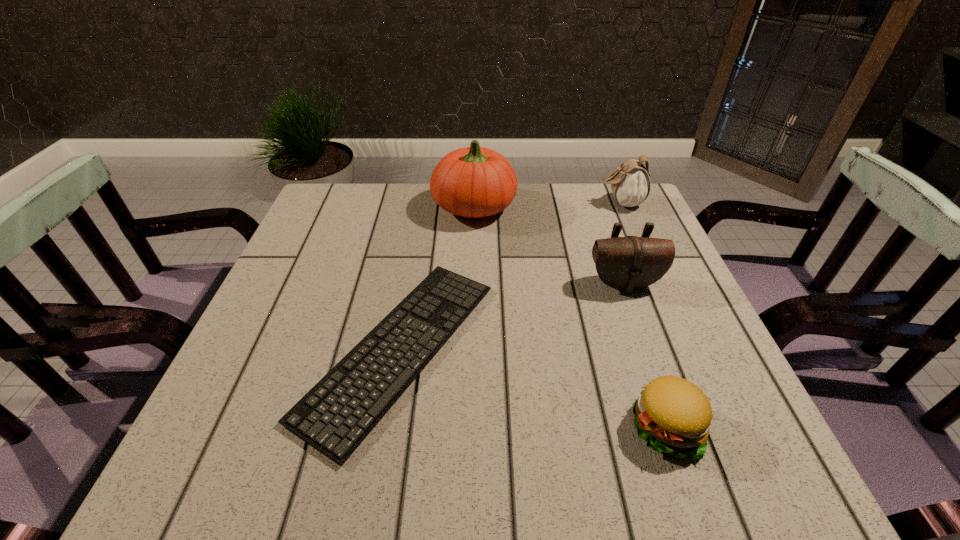
Where is `object that is at the near right corner`? This screenshot has height=540, width=960. object that is at the near right corner is located at coordinates (673, 415).

In the image, there is a desktop. At what (x,y) coordinates should I click in order to perform the action: click on free space at the far edge. Please return your answer as a coordinate pair (x, y). The width and height of the screenshot is (960, 540). Looking at the image, I should click on (403, 213).

Find the location of a particular element. The height and width of the screenshot is (540, 960). free region at the near edge is located at coordinates (438, 435).

This screenshot has height=540, width=960. Identify the location of blank space at the left edge. (329, 294).

You are a GUI agent. You are given a task and a screenshot of the screen. Output one action in this format:
    pyautogui.click(x=<x>, y=<y>)
    Task: Click on the vacant region at the right edge of the desktop
    This screenshot has width=960, height=540.
    Given the screenshot: What is the action you would take?
    pyautogui.click(x=685, y=378)

What are the coordinates of `blank region between the farther pouch and the tallest object` in the screenshot? It's located at (547, 205).

I want to click on blank region between the tallest object and the fourth tallest object, so click(x=569, y=316).

This screenshot has height=540, width=960. I want to click on free spot between the hamburger and the tallest object, so click(569, 316).

You are a GUI agent. You are given a task and a screenshot of the screen. Output one action in this format:
    pyautogui.click(x=<x>, y=<y>)
    Task: Click on the free space between the hamburger and the nearer pouch
    The width and height of the screenshot is (960, 540).
    Given the screenshot: What is the action you would take?
    pyautogui.click(x=644, y=355)

Where is `vacant area between the computer keyboard and the fourth tallest object`? vacant area between the computer keyboard and the fourth tallest object is located at coordinates (533, 388).